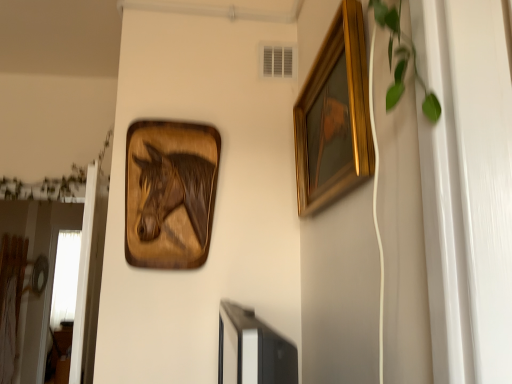
Question: From a real-world perspective, is gold wooden picture frame at upper right positioned over green leafy plant at upper right based on gravity?

Choices:
 (A) no
 (B) yes

Answer: (A)

Question: Can you confirm if gold wooden picture frame at upper right is positioned to the left of green leafy plant at upper right?

Choices:
 (A) yes
 (B) no

Answer: (A)

Question: From the image's perspective, is gold wooden picture frame at upper right located beneath green leafy plant at upper right?

Choices:
 (A) yes
 (B) no

Answer: (A)

Question: Is gold wooden picture frame at upper right next to green leafy plant at upper right and touching it?

Choices:
 (A) no
 (B) yes

Answer: (A)

Question: Considering the relative sizes of gold wooden picture frame at upper right and green leafy plant at upper right in the image provided, is gold wooden picture frame at upper right smaller than green leafy plant at upper right?

Choices:
 (A) no
 (B) yes

Answer: (A)

Question: Is gold wooden picture frame at upper right completely or partially outside of green leafy plant at upper right?

Choices:
 (A) no
 (B) yes

Answer: (B)

Question: Considering the relative sizes of wooden horse at upper left and gold wooden picture frame at upper right in the image provided, is wooden horse at upper left taller than gold wooden picture frame at upper right?

Choices:
 (A) no
 (B) yes

Answer: (B)

Question: Can you see wooden horse at upper left touching gold wooden picture frame at upper right?

Choices:
 (A) no
 (B) yes

Answer: (A)

Question: Is the position of wooden horse at upper left more distant than that of gold wooden picture frame at upper right?

Choices:
 (A) yes
 (B) no

Answer: (A)

Question: From a real-world perspective, is wooden horse at upper left located higher than gold wooden picture frame at upper right?

Choices:
 (A) yes
 (B) no

Answer: (B)

Question: Considering the relative sizes of wooden horse at upper left and gold wooden picture frame at upper right in the image provided, is wooden horse at upper left thinner than gold wooden picture frame at upper right?

Choices:
 (A) no
 (B) yes

Answer: (A)

Question: From the image's perspective, does wooden horse at upper left appear higher than gold wooden picture frame at upper right?

Choices:
 (A) no
 (B) yes

Answer: (A)

Question: Is green leafy plant at upper right thinner than gold wooden picture frame at upper right?

Choices:
 (A) no
 (B) yes

Answer: (B)